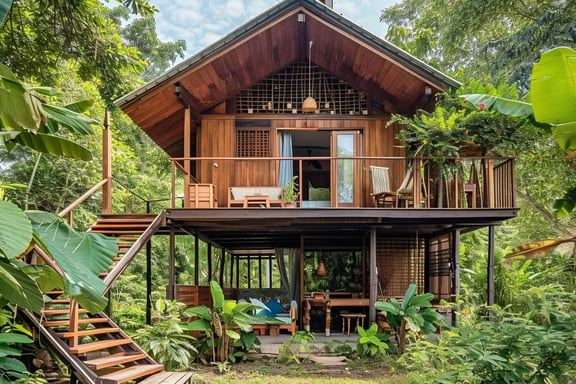
Where is `concrete floor`? Image resolution: width=576 pixels, height=384 pixels. concrete floor is located at coordinates (260, 343).